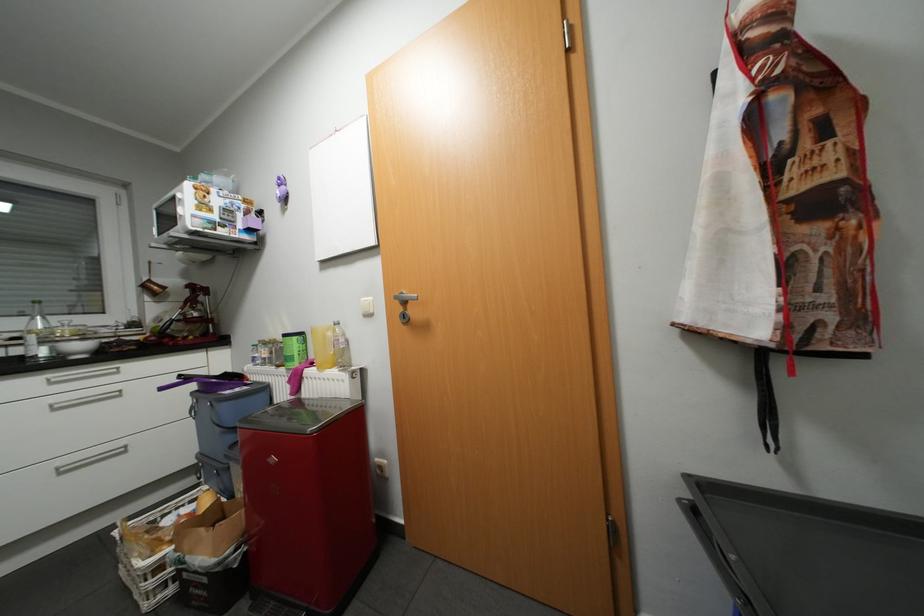
Where is `silver door handle`? The height and width of the screenshot is (616, 924). silver door handle is located at coordinates (405, 297).